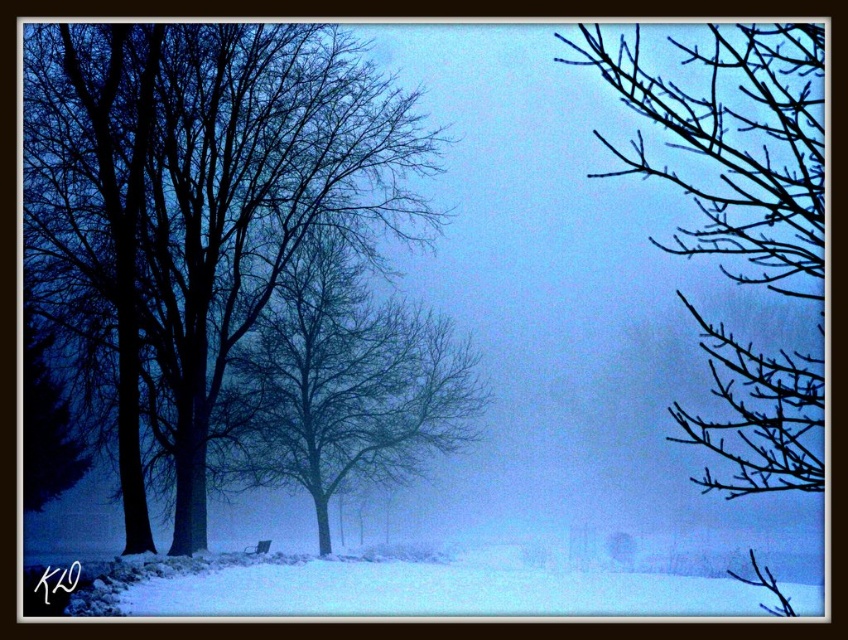
Question: Can you confirm if black matte tree at left is thinner than black bare branches at upper right?

Choices:
 (A) no
 (B) yes

Answer: (B)

Question: Is black matte tree at left further to the viewer compared to black bare branches at upper right?

Choices:
 (A) no
 (B) yes

Answer: (B)

Question: Is black matte tree at left positioned at the back of bare branches at center?

Choices:
 (A) yes
 (B) no

Answer: (B)

Question: Which of the following is the closest to the observer?

Choices:
 (A) bare branches at center
 (B) black bare branches at upper right

Answer: (B)

Question: Which point is closer to the camera?

Choices:
 (A) black bare branches at upper right
 (B) black matte tree at left
 (C) bare branches at center

Answer: (A)

Question: Among these objects, which one is nearest to the camera?

Choices:
 (A) black bare branches at upper right
 (B) bare branches at center
 (C) black matte tree at left

Answer: (A)